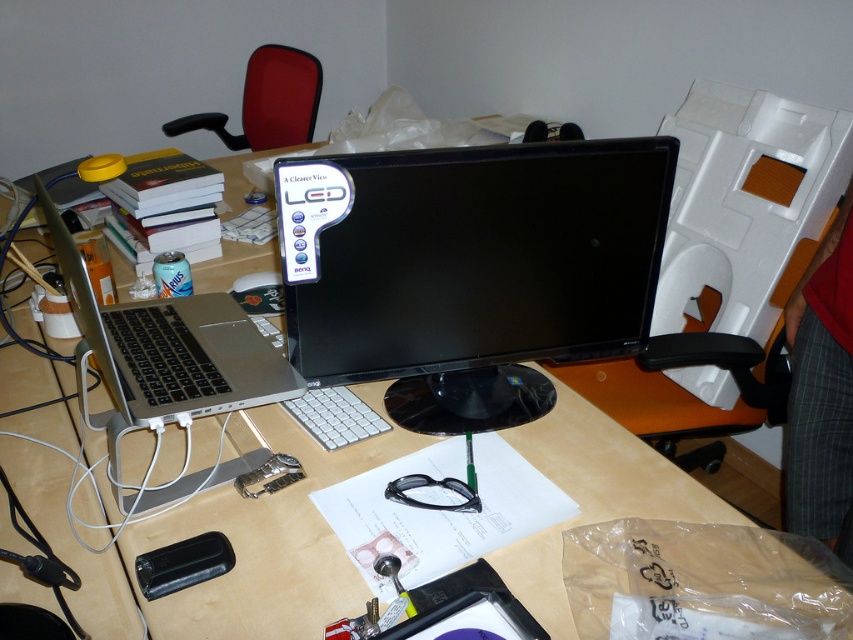
Looking at this image, what is the exact position of the black glossy monitor at center?

The black glossy monitor at center is located at point (469, 269).

You are a delivery person who needs to place a rectangular package that is 30 centimeters long on the desk. The package must be placed between the black glossy monitor at center and the satin silver laptop at left without touching either. Is there enough space?

The distance between the black glossy monitor at center and the satin silver laptop at left is 27.45 centimeters. Since the package is 30 centimeters long, it cannot fit in the space between them without overlapping either object.

You are organizing the desk and want to place the black glossy monitor at center and the satin silver laptop at left into a storage box. The box can only fit items that are smaller than the laptop. Which item will fit inside the box?

The black glossy monitor at center is smaller than the satin silver laptop at left, so it will fit inside the storage box.